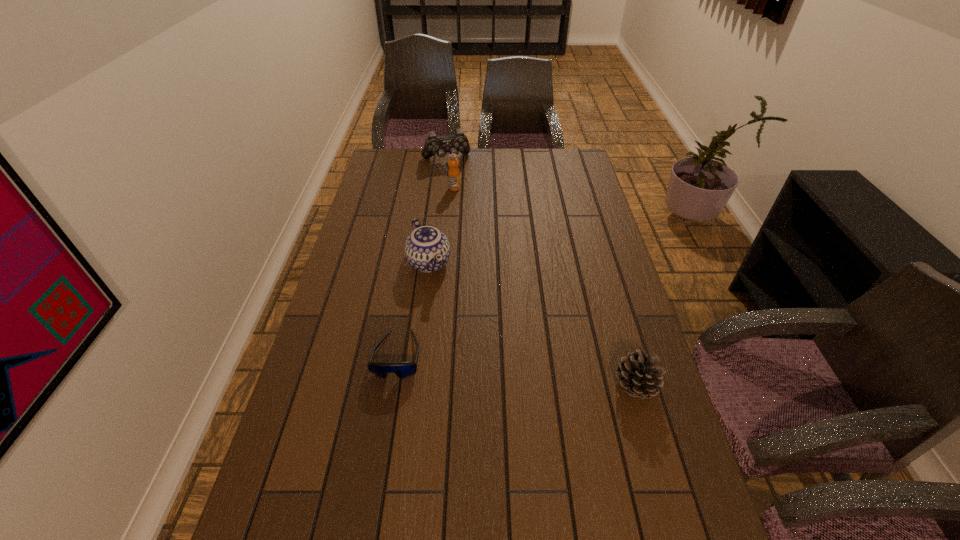
Locate an element on the screen. Image resolution: width=960 pixels, height=540 pixels. the shortest object is located at coordinates (402, 370).

Identify the location of the rightmost object. (637, 374).

The image size is (960, 540). I want to click on the third farthest object, so click(427, 249).

What are the coordinates of `the farthest object` in the screenshot? It's located at (453, 144).

Locate an element on the screen. the fourth nearest object is located at coordinates (453, 173).

This screenshot has height=540, width=960. I want to click on vacant space located 0.270m on the front-facing side of the sunglasses, so click(x=374, y=493).

Where is `vacant area situated 0.100m on the back of the rightmost object`? vacant area situated 0.100m on the back of the rightmost object is located at coordinates point(620,337).

Image resolution: width=960 pixels, height=540 pixels. Identify the location of vacant space located at the spout of the third farthest object. (480, 358).

Image resolution: width=960 pixels, height=540 pixels. I want to click on vacant region located at the spout of the third farthest object, so click(x=489, y=372).

What are the coordinates of `vacant space located at the spout of the third farthest object` in the screenshot? It's located at (459, 321).